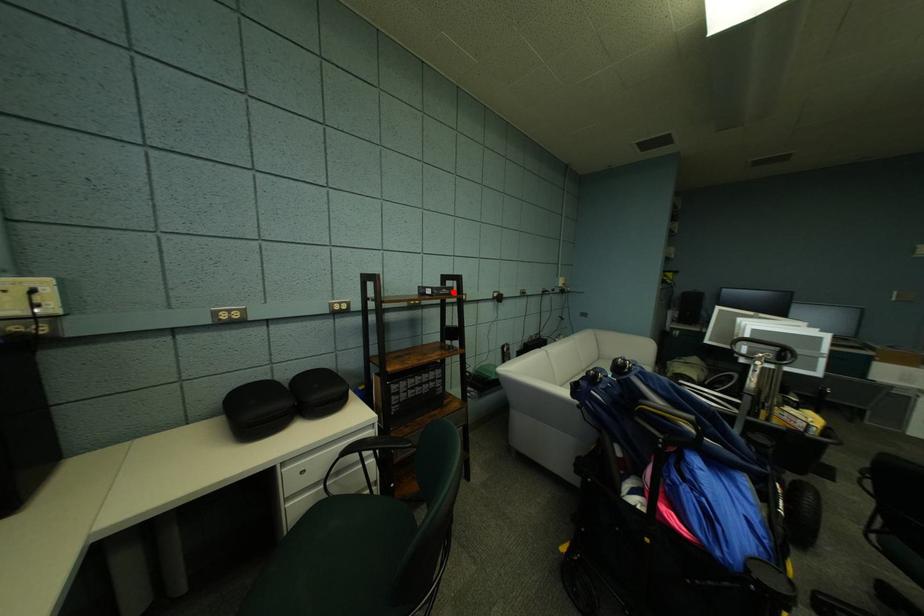
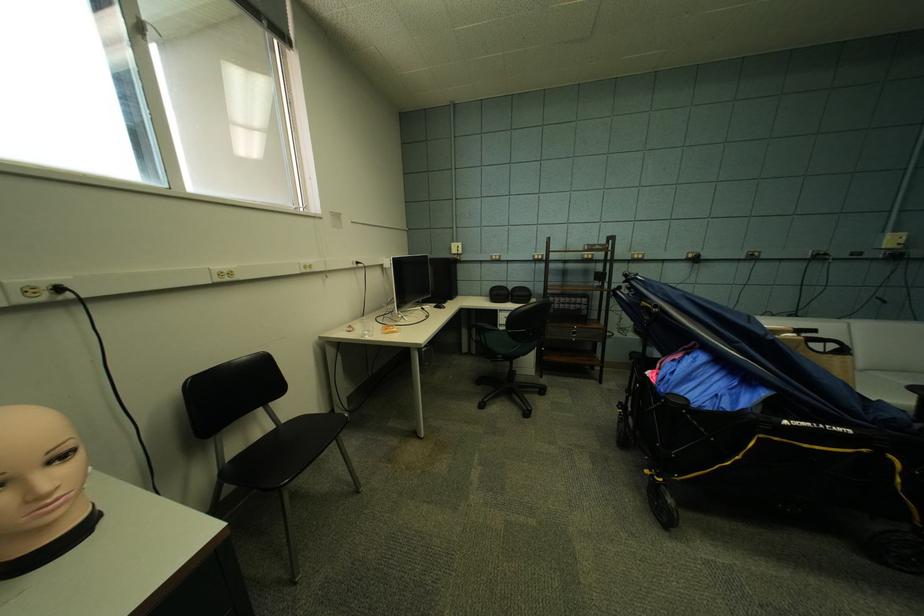
The point at the highlighted location is marked in the first image. Where is the corresponding point in the second image?

(606, 248)